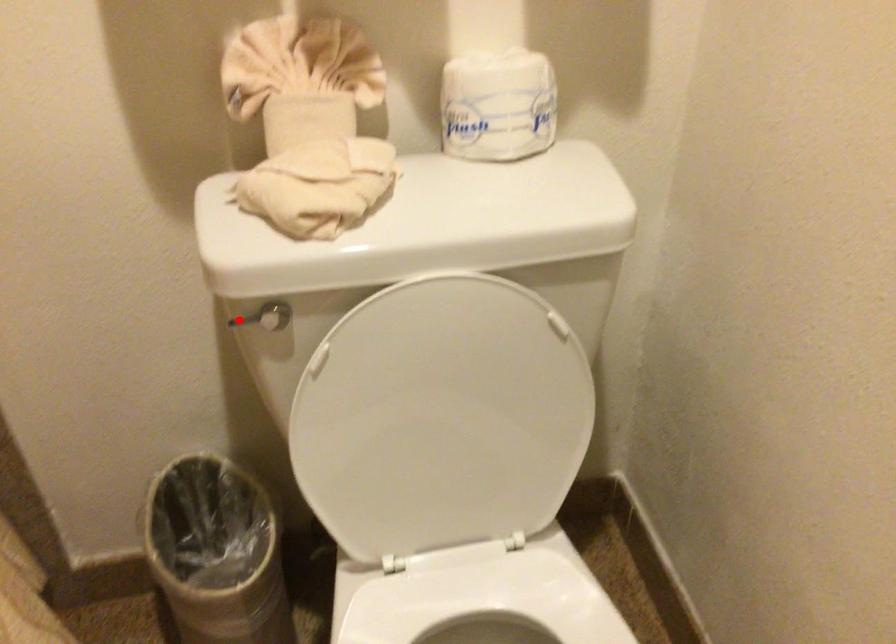
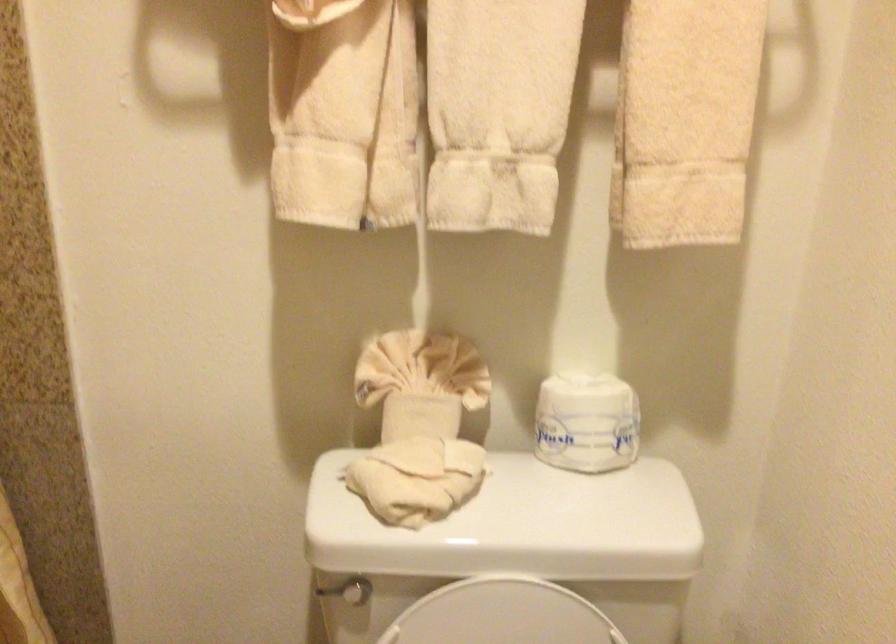
The point at the highlighted location is marked in the first image. Where is the corresponding point in the second image?

(326, 590)